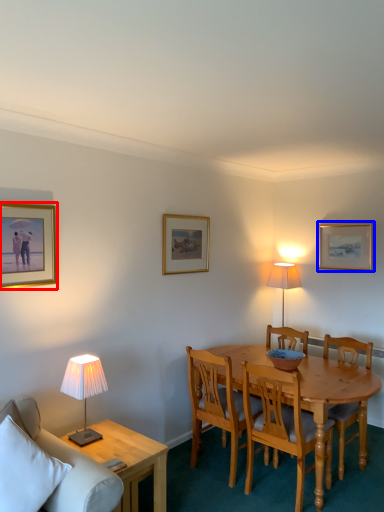
Question: Which of the following is the farthest to the observer, picture frame (highlighted by a red box) or picture frame (highlighted by a blue box)?

Choices:
 (A) picture frame
 (B) picture frame

Answer: (B)